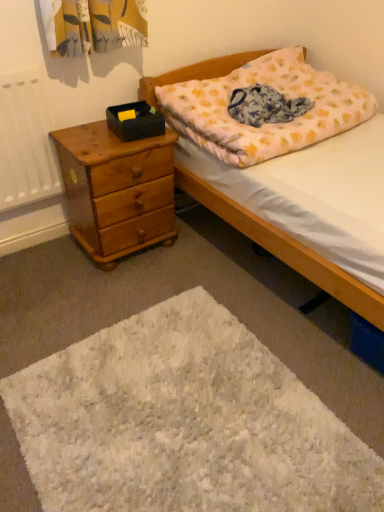
Locate an element on the screen. vacant region below white fluffy mat at lower center (from a real-world perspective) is located at coordinates (225, 452).